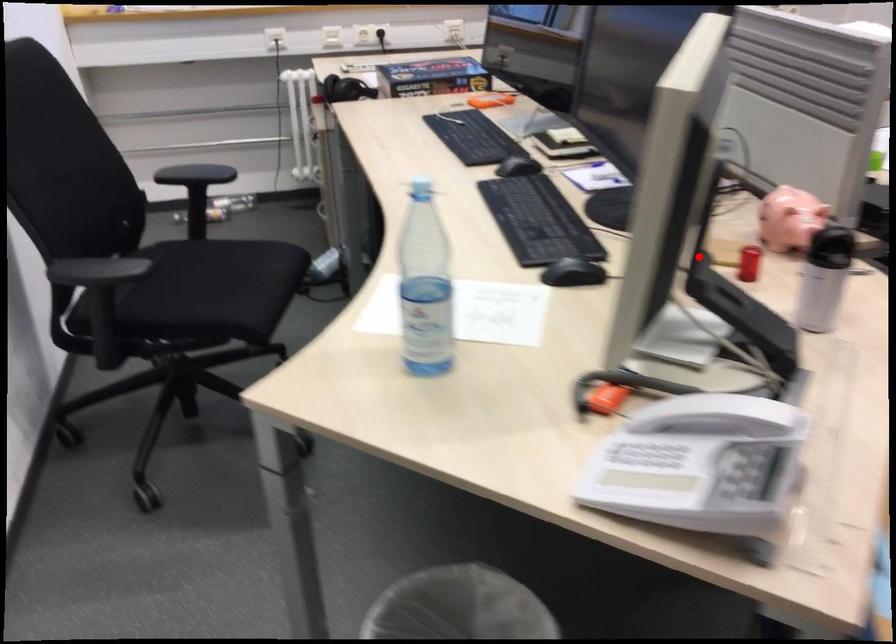
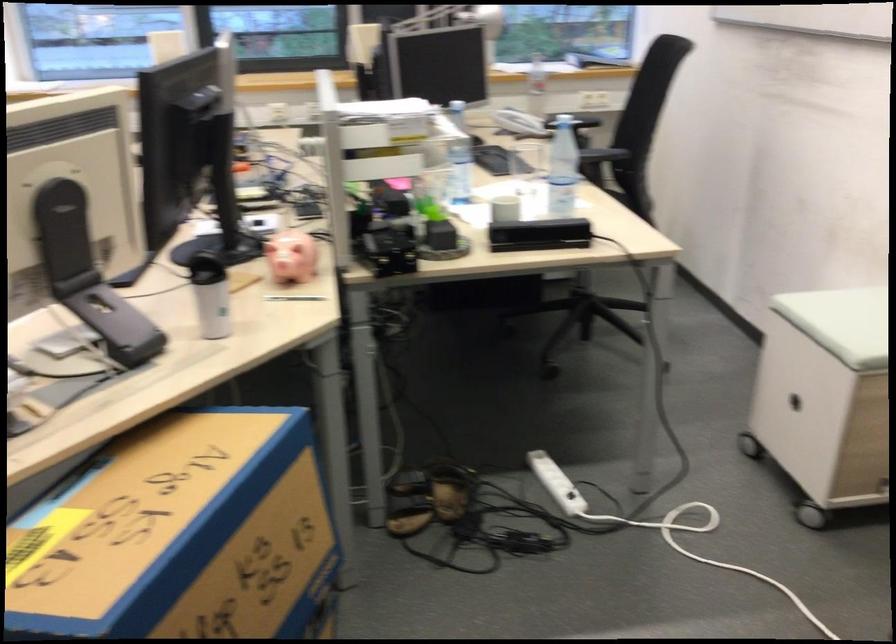
Question: I am providing you with two images of the same scene from different viewpoints. Given a red point in image1, look at the same physical point in image2. Is it:

Choices:
 (A) Closer to the viewpoint
 (B) Farther from the viewpoint

Answer: (B)